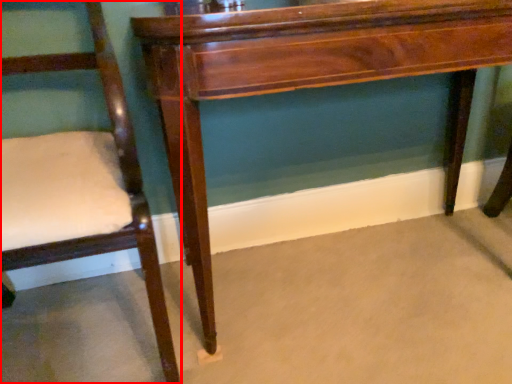
Question: Observing the image, what is the correct spatial positioning of chair (annotated by the red box) in reference to table?

Choices:
 (A) right
 (B) left

Answer: (B)